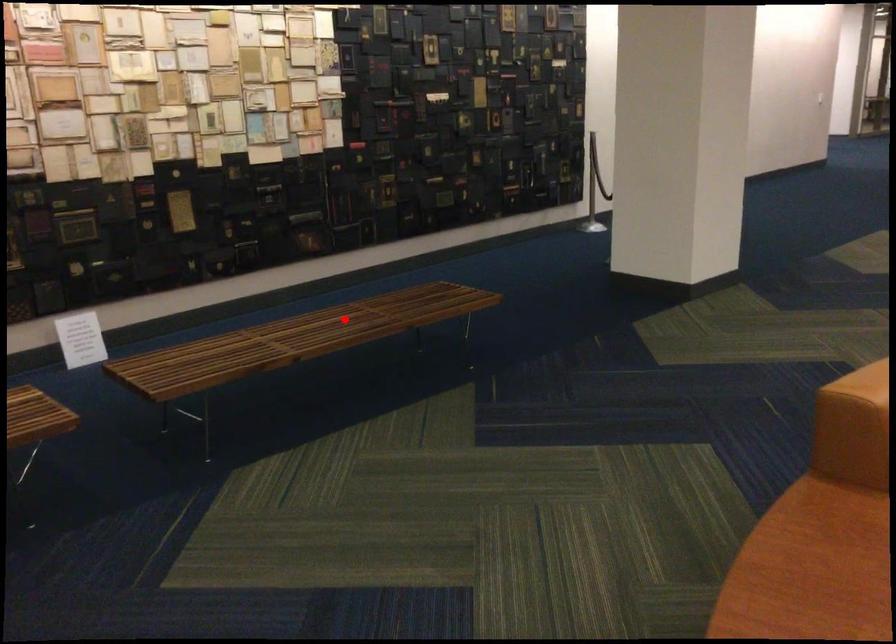
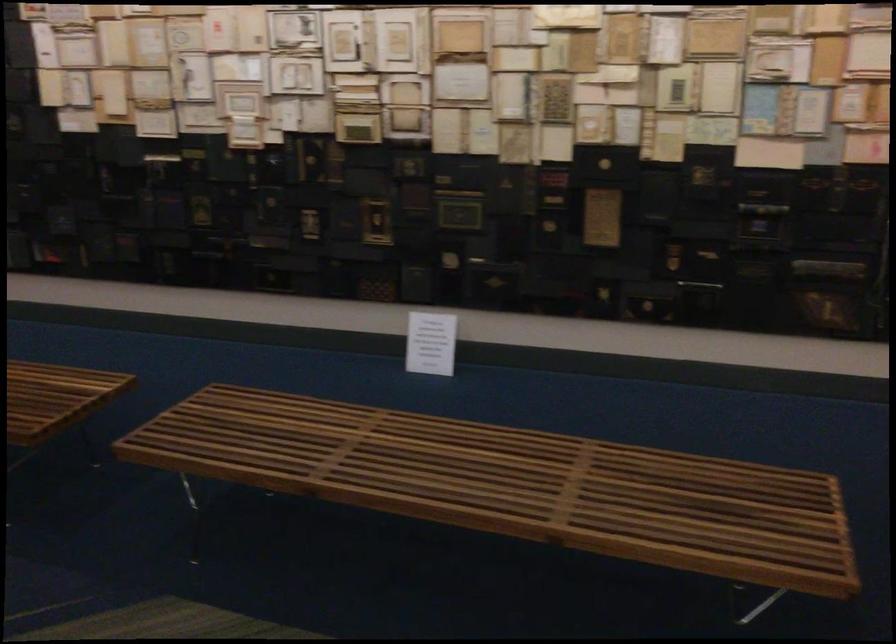
Locate, in the second image, the point that corresponds to the highlighted location in the first image.

(501, 475)